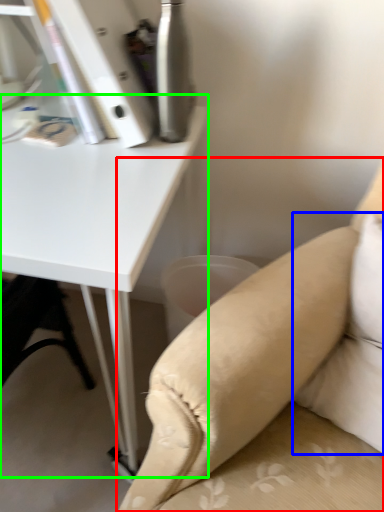
Question: Which is farther away from studio couch (highlighted by a red box)? pillow (highlighted by a blue box) or table (highlighted by a green box)?

Choices:
 (A) pillow
 (B) table

Answer: (B)